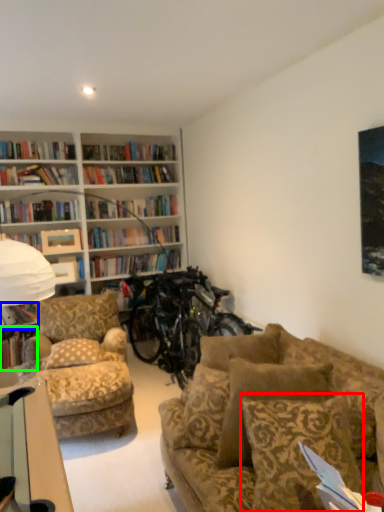
Question: Which is nearer to the pillow (highlighted by a red box)? book (highlighted by a blue box) or book (highlighted by a green box).

Choices:
 (A) book
 (B) book

Answer: (A)